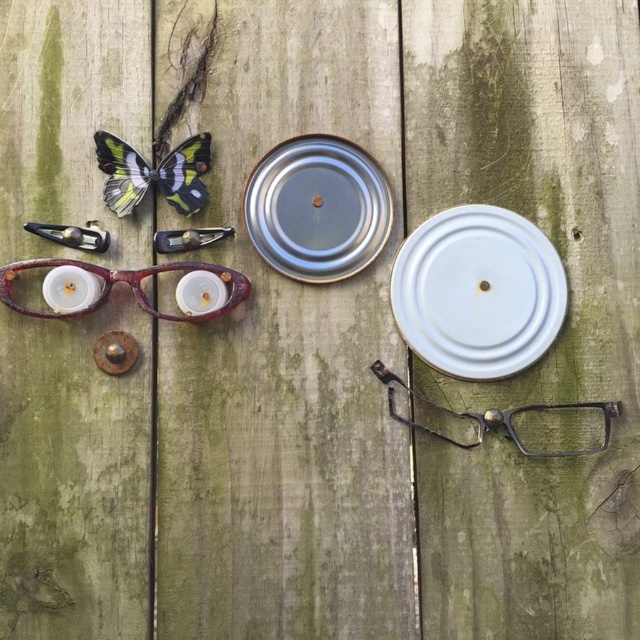
You are an interior designer analyzing the layout of objects on a weathered wooden surface. The scene includes a decorative butterfly in the upper left corner, two hair clips below it, and two circular metal lids to their right. There is also a white matte plate at center. Based on their 2D positions, which object is closer to the bottom edge of the wooden surface?

The white matte plate at center is closer to the bottom edge of the wooden surface because its 2D location at point (477,292) places it lower on the surface compared to the decorative butterfly in the upper left corner and the hair clips and metal lids positioned above it.

You are setting up a small table for a tea party. The white matte plate at center is where you want to place the teacup, and the metallic wire frame glasses at lower right will hold the guests glasses. How far apart are these two items from each other?

The white matte plate at center and metallic wire frame glasses at lower right are 2.15 inches apart.